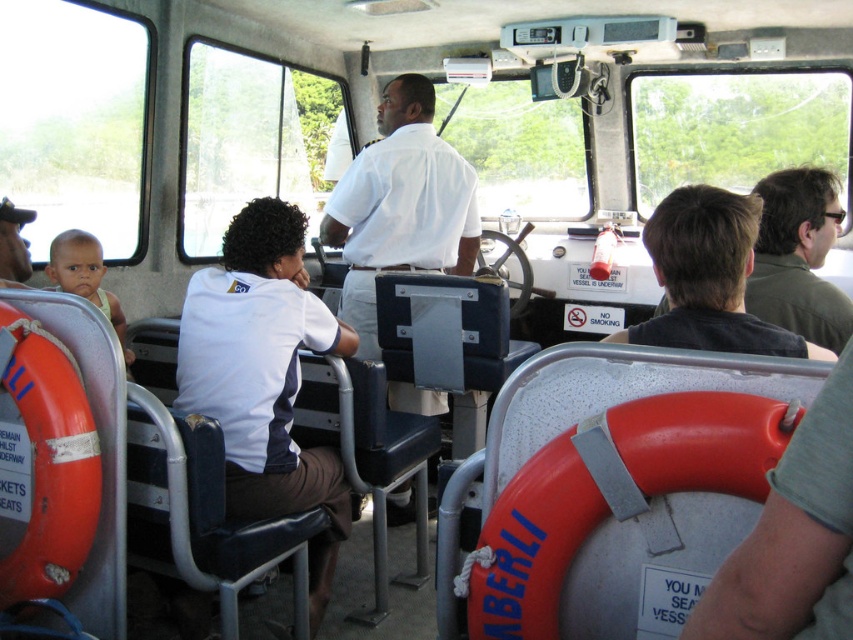
You are a passenger sitting in the boat cabin and want to reach the front to ask the captain a question. You see the white fabric shirt at center and the orange rubber life jacket at left. Which object is closer to you as you move forward?

The white fabric shirt at center is closer to you because it is further to the viewer than the orange rubber life jacket at left, meaning it is nearer in your line of sight as you move forward.

You are a passenger on the boat and need to choose between two shirts hanging on hooks near the seats. The shirts are the white fabric shirt at center and the white matte shirt at center. Which shirt is narrower in width?

The white fabric shirt at center is narrower in width than the white matte shirt at center according to the description.